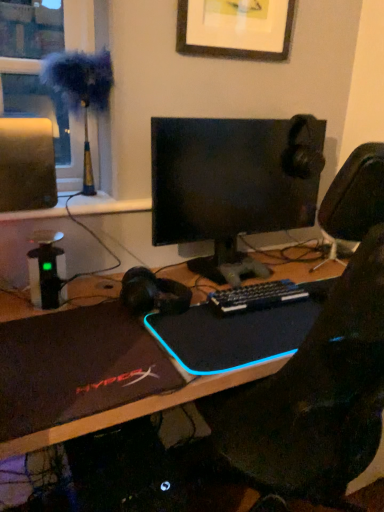
The image size is (384, 512). I want to click on unoccupied area in front of black plastic keyboard at center, so click(253, 333).